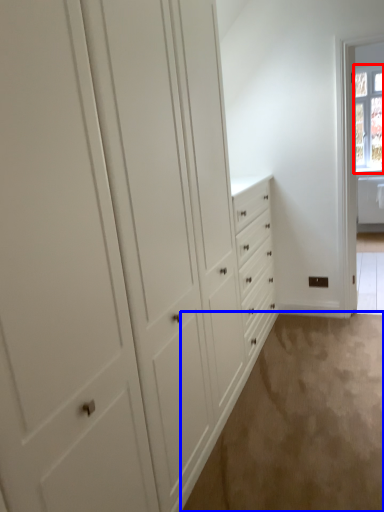
Question: Among these objects, which one is nearest to the camera, window (highlighted by a red box) or plain (highlighted by a blue box)?

Choices:
 (A) window
 (B) plain

Answer: (B)